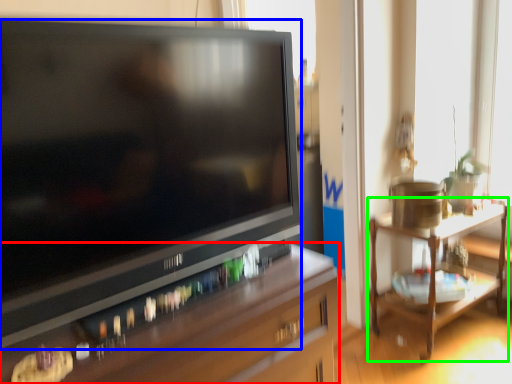
Question: Considering the real-world distances, which object is farthest from desk (highlighted by a red box)? television (highlighted by a blue box) or table (highlighted by a green box)?

Choices:
 (A) television
 (B) table

Answer: (B)